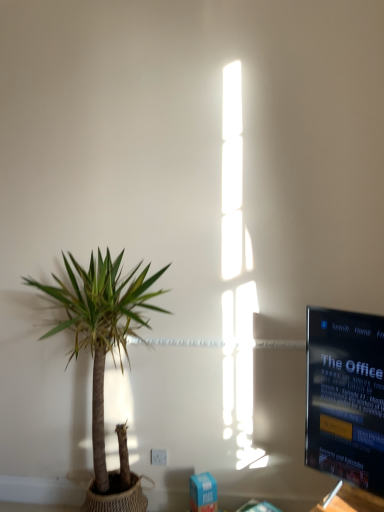
Identify the location of green leafy plant at left. This screenshot has height=512, width=384. (101, 327).

What is the approximate width of green leafy plant at left?

green leafy plant at left is 22.42 inches wide.

What do you see at coordinates (101, 327) in the screenshot? I see `green leafy plant at left` at bounding box center [101, 327].

What do you see at coordinates (159, 457) in the screenshot?
I see `white plastic electric outlet at lower center` at bounding box center [159, 457].

Identify the location of white plastic electric outlet at lower center. This screenshot has width=384, height=512. (159, 457).

Identify the location of green leafy plant at left. (101, 327).

Which object is positioned more to the right, white plastic electric outlet at lower center or green leafy plant at left?

white plastic electric outlet at lower center is more to the right.

Is the position of white plastic electric outlet at lower center less distant than that of green leafy plant at left?

No, it is not.

Considering the points (150, 452) and (88, 345), which point is behind, point (150, 452) or point (88, 345)?

The point (88, 345) is farther.

From the image's perspective, does white plastic electric outlet at lower center appear higher than green leafy plant at left?

No, from the image's perspective, white plastic electric outlet at lower center is not on top of green leafy plant at left.

In the scene shown: From a real-world perspective, is white plastic electric outlet at lower center physically above green leafy plant at left?

No, from a real-world perspective, white plastic electric outlet at lower center is not above green leafy plant at left.

Considering the sizes of objects white plastic electric outlet at lower center and green leafy plant at left in the image provided, who is thinner, white plastic electric outlet at lower center or green leafy plant at left?

With smaller width is white plastic electric outlet at lower center.

Who is shorter, white plastic electric outlet at lower center or green leafy plant at left?

With less height is white plastic electric outlet at lower center.

Based on their sizes in the image, would you say white plastic electric outlet at lower center is bigger or smaller than green leafy plant at left?

Clearly, white plastic electric outlet at lower center is smaller in size than green leafy plant at left.

Which is correct: white plastic electric outlet at lower center is inside green leafy plant at left, or outside of it?

white plastic electric outlet at lower center is spatially positioned inside green leafy plant at left.

Is there a large distance between white plastic electric outlet at lower center and green leafy plant at left?

white plastic electric outlet at lower center is actually quite close to green leafy plant at left.

Is white plastic electric outlet at lower center oriented away from green leafy plant at left?

Correct, white plastic electric outlet at lower center is looking away from green leafy plant at left.

Find the location of a particular element. electric outlet below the green leafy plant at left (from a real-world perspective) is located at coordinates (159, 457).

Can you confirm if green leafy plant at left is positioned to the left of white plastic electric outlet at lower center?

Yes.

Looking at this image, which is in front, green leafy plant at left or white plastic electric outlet at lower center?

green leafy plant at left is more forward.

Considering the positions of point (59, 297) and point (164, 458), is point (59, 297) closer or farther from the camera than point (164, 458)?

Clearly, point (59, 297) is closer to the camera than point (164, 458).

From the image's perspective, is green leafy plant at left positioned above or below white plastic electric outlet at lower center?

green leafy plant at left is situated higher than white plastic electric outlet at lower center in the image.

From a real-world perspective, is green leafy plant at left above or below white plastic electric outlet at lower center?

In terms of real-world spatial position, green leafy plant at left is above white plastic electric outlet at lower center.

Can you confirm if green leafy plant at left is wider than white plastic electric outlet at lower center?

Yes.

Consider the image. Who is taller, green leafy plant at left or white plastic electric outlet at lower center?

Standing taller between the two is green leafy plant at left.

Is green leafy plant at left bigger than white plastic electric outlet at lower center?

Yes, green leafy plant at left is bigger than white plastic electric outlet at lower center.

Can we say green leafy plant at left lies outside white plastic electric outlet at lower center?

That's correct, green leafy plant at left is outside of white plastic electric outlet at lower center.

Is the surface of green leafy plant at left in direct contact with white plastic electric outlet at lower center?

green leafy plant at left and white plastic electric outlet at lower center are not in contact.

In the scene shown: Could you tell me if green leafy plant at left is facing white plastic electric outlet at lower center?

No, green leafy plant at left is not oriented towards white plastic electric outlet at lower center.

Identify the location of electric outlet below the green leafy plant at left (from the image's perspective). The image size is (384, 512). (159, 457).

This screenshot has height=512, width=384. I want to click on electric outlet on the right of green leafy plant at left, so click(159, 457).

The width and height of the screenshot is (384, 512). In order to click on electric outlet below the green leafy plant at left (from a real-world perspective) in this screenshot , I will do `click(159, 457)`.